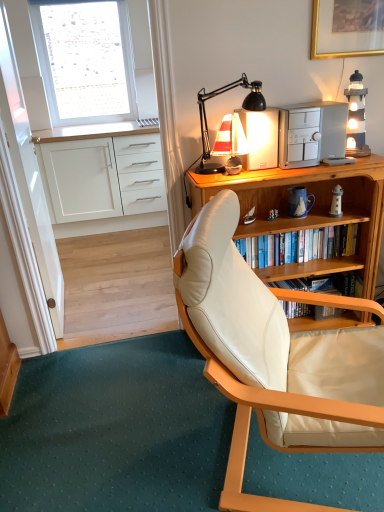
Identify the location of free area below beige leather chair at center (from a real-world perspective). The height and width of the screenshot is (512, 384). (315, 474).